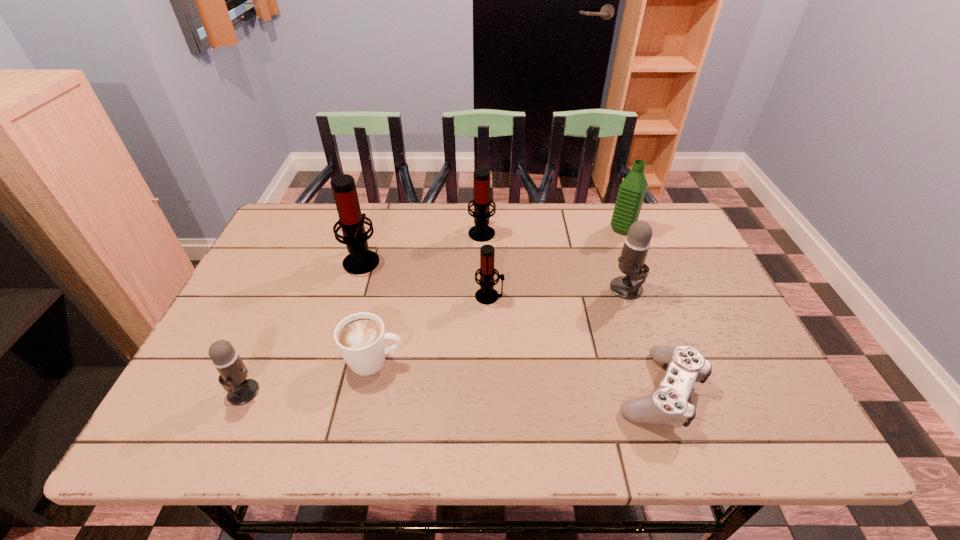
Find the location of a particular element. This screenshot has width=960, height=540. free space located 0.130m with the handle on the side of the white cappuccino is located at coordinates (462, 361).

Where is `vacant space situated on the right of the control`? vacant space situated on the right of the control is located at coordinates (760, 390).

Find the location of a particular element. water bottle present at the far edge is located at coordinates (632, 190).

Where is `microphone located in the near edge section of the desktop`? This screenshot has height=540, width=960. microphone located in the near edge section of the desktop is located at coordinates pos(233,373).

You are a GUI agent. You are given a task and a screenshot of the screen. Output one action in this format:
    pyautogui.click(x=<x>, y=<y>)
    Task: Click on the control positioned at the near edge
    
    Given the screenshot: What is the action you would take?
    pyautogui.click(x=668, y=405)

Identify the location of object positioned at the left edge. (233, 373).

Find the location of `water bottle located in the right edge section of the desktop`. water bottle located in the right edge section of the desktop is located at coordinates (x=632, y=190).

Image resolution: width=960 pixels, height=540 pixels. In order to click on control located at the right edge in this screenshot , I will do `click(668, 405)`.

Locate an element on the screen. This screenshot has width=960, height=540. object present at the near left corner is located at coordinates (233, 373).

Find the location of a particular element. This screenshot has height=540, width=960. object that is at the far right corner is located at coordinates (632, 190).